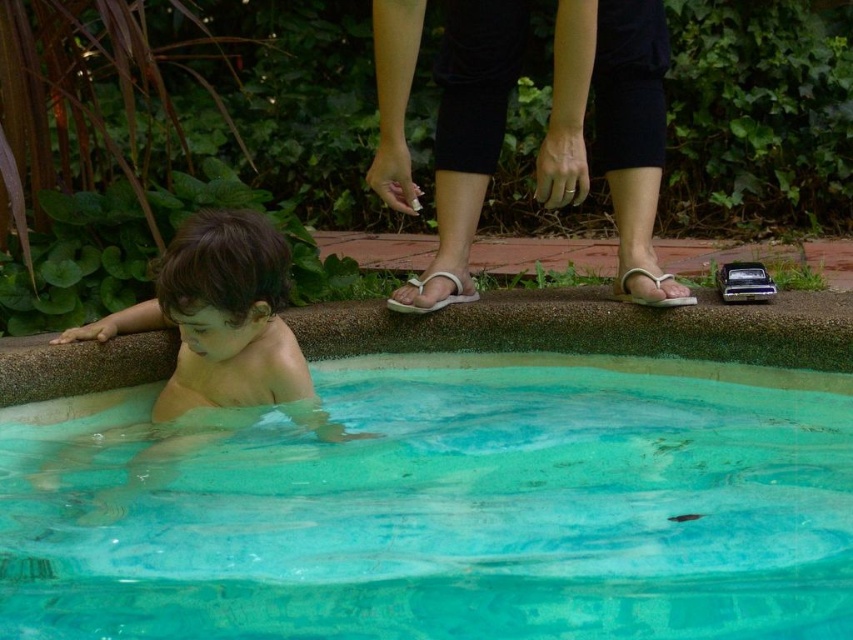
Does clear plastic water at lower center appear over white fabric sandal at center?

No, clear plastic water at lower center is not above white fabric sandal at center.

Can you confirm if clear plastic water at lower center is shorter than white fabric sandal at center?

No, clear plastic water at lower center is not shorter than white fabric sandal at center.

Is point (387, 561) farther from camera compared to point (387, 300)?

No, (387, 561) is in front of (387, 300).

Where is `clear plastic water at lower center`? The height and width of the screenshot is (640, 853). clear plastic water at lower center is located at coordinates (457, 509).

Is white leather sandals at center closer to camera compared to smooth skin child at lower left?

No, it is behind smooth skin child at lower left.

Image resolution: width=853 pixels, height=640 pixels. What are the coordinates of `white leather sandals at center` in the screenshot? It's located at (608, 115).

Is clear plastic water at lower center closer to the viewer compared to smooth skin child at lower left?

Yes, it is.

From the picture: Between clear plastic water at lower center and smooth skin child at lower left, which one has less height?

Standing shorter between the two is clear plastic water at lower center.

Where is `clear plastic water at lower center`? This screenshot has width=853, height=640. clear plastic water at lower center is located at coordinates (457, 509).

This screenshot has height=640, width=853. Find the location of `clear plastic water at lower center`. clear plastic water at lower center is located at coordinates (457, 509).